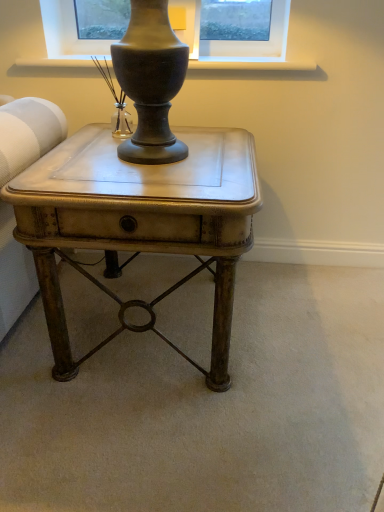
Question: Based on their sizes in the image, would you say matte brown side table at center is bigger or smaller than matte wood window sill at upper center?

Choices:
 (A) big
 (B) small

Answer: (A)

Question: Looking at their shapes, would you say matte brown side table at center is wider or thinner than matte wood window sill at upper center?

Choices:
 (A) wide
 (B) thin

Answer: (A)

Question: Which is correct: matte brown side table at center is inside matte wood window sill at upper center, or outside of it?

Choices:
 (A) inside
 (B) outside

Answer: (B)

Question: Looking at their shapes, would you say matte wood window sill at upper center is wider or thinner than matte brown side table at center?

Choices:
 (A) thin
 (B) wide

Answer: (A)

Question: In the image, is matte wood window sill at upper center positioned in front of or behind matte brown side table at center?

Choices:
 (A) front
 (B) behind

Answer: (B)

Question: Considering the relative positions of matte wood window sill at upper center and matte brown side table at center in the image provided, is matte wood window sill at upper center to the left or to the right of matte brown side table at center?

Choices:
 (A) right
 (B) left

Answer: (A)

Question: From their relative heights in the image, would you say matte wood window sill at upper center is taller or shorter than matte brown side table at center?

Choices:
 (A) tall
 (B) short

Answer: (B)